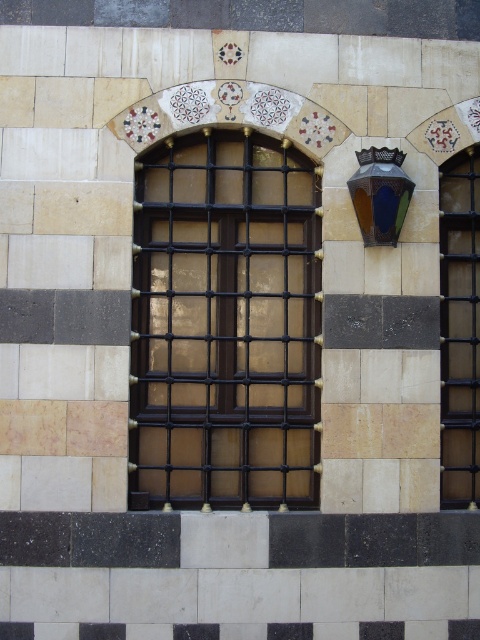
Question: Does black metal grid at center appear under black metal grid at right?

Choices:
 (A) yes
 (B) no

Answer: (B)

Question: Considering the relative positions of black metal grid at center and black metal grid at right in the image provided, where is black metal grid at center located with respect to black metal grid at right?

Choices:
 (A) left
 (B) right

Answer: (A)

Question: Does black metal grid at center have a larger size compared to black metal grid at right?

Choices:
 (A) yes
 (B) no

Answer: (A)

Question: Which point is closer to the camera taking this photo?

Choices:
 (A) (469, 147)
 (B) (286, 496)

Answer: (B)

Question: Which point is farther to the camera?

Choices:
 (A) (203, 269)
 (B) (460, 484)

Answer: (B)

Question: Which object is farther from the camera taking this photo?

Choices:
 (A) black metal grid at center
 (B) black metal grid at right

Answer: (B)